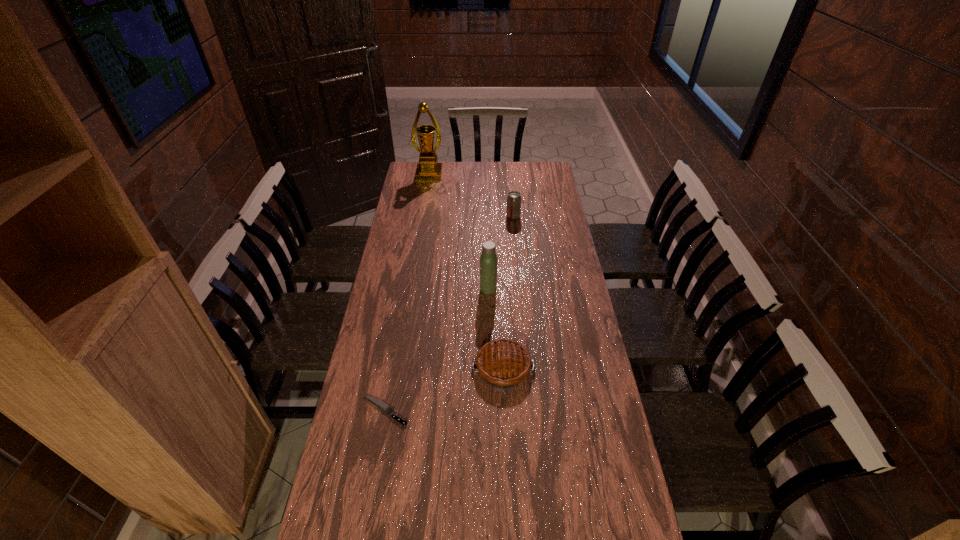
The height and width of the screenshot is (540, 960). What are the coordinates of `award` in the screenshot? It's located at (428, 169).

Where is `the farthest object`? This screenshot has height=540, width=960. the farthest object is located at coordinates (428, 169).

At what (x,y) coordinates should I click in order to perform the action: click on the third farthest object. Please return your answer as a coordinate pair (x, y). The image size is (960, 540). Looking at the image, I should click on (488, 260).

You are a GUI agent. You are given a task and a screenshot of the screen. Output one action in this format:
    pyautogui.click(x=<x>, y=<y>)
    Task: Click on the second tallest object
    The width and height of the screenshot is (960, 540).
    Given the screenshot: What is the action you would take?
    pyautogui.click(x=488, y=260)

Locate an element on the screen. the third shortest object is located at coordinates (514, 198).

This screenshot has height=540, width=960. I want to click on soda can, so click(514, 198).

Where is `the second nearest object`? the second nearest object is located at coordinates (502, 363).

At what (x,y) coordinates should I click in order to perform the action: click on pie. Please return your answer as a coordinate pair (x, y). The width and height of the screenshot is (960, 540). Looking at the image, I should click on (502, 363).

Find the location of a particular element. the nearest object is located at coordinates (384, 407).

Where is `the shortest object`? This screenshot has width=960, height=540. the shortest object is located at coordinates (384, 407).